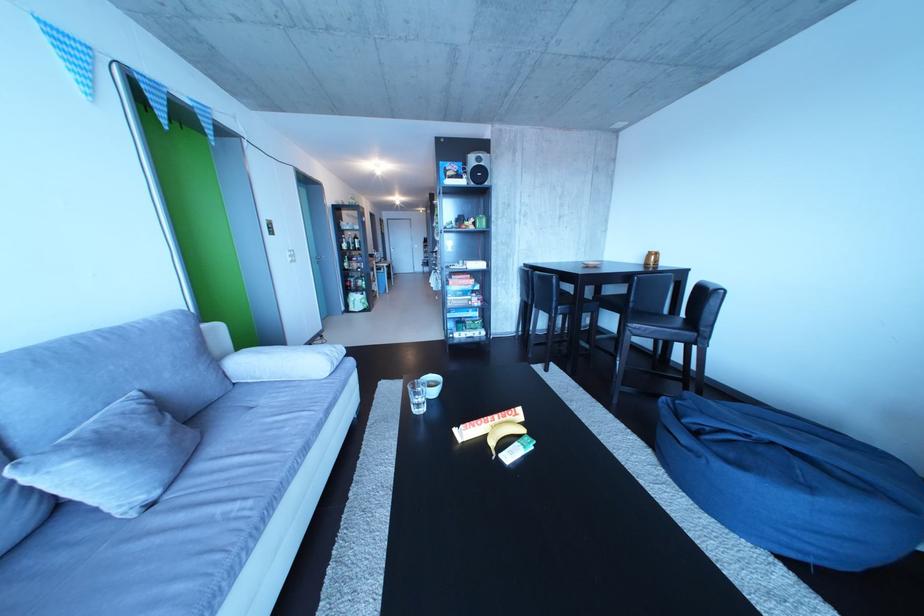
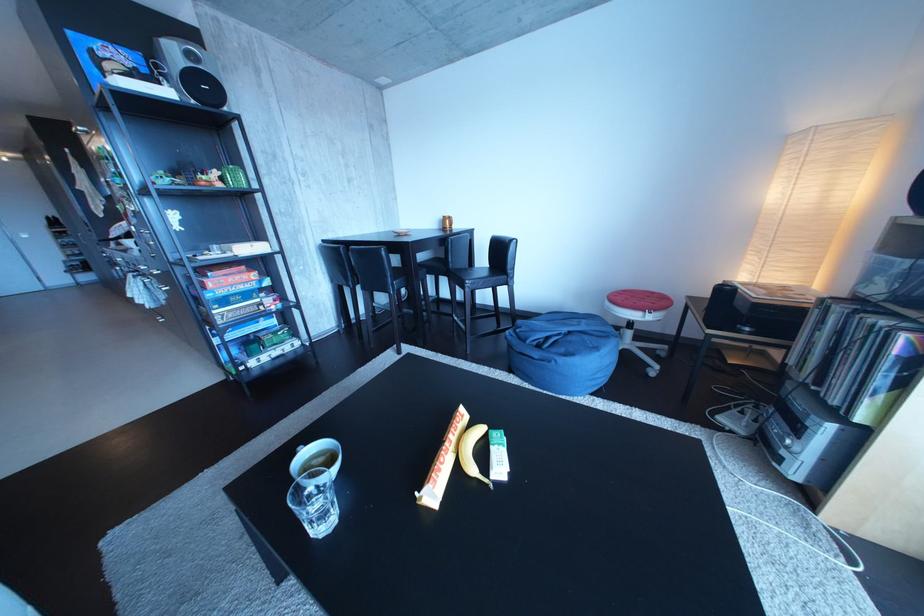
The point at [446,390] is marked in the first image. Where is the corresponding point in the second image?

(334, 466)